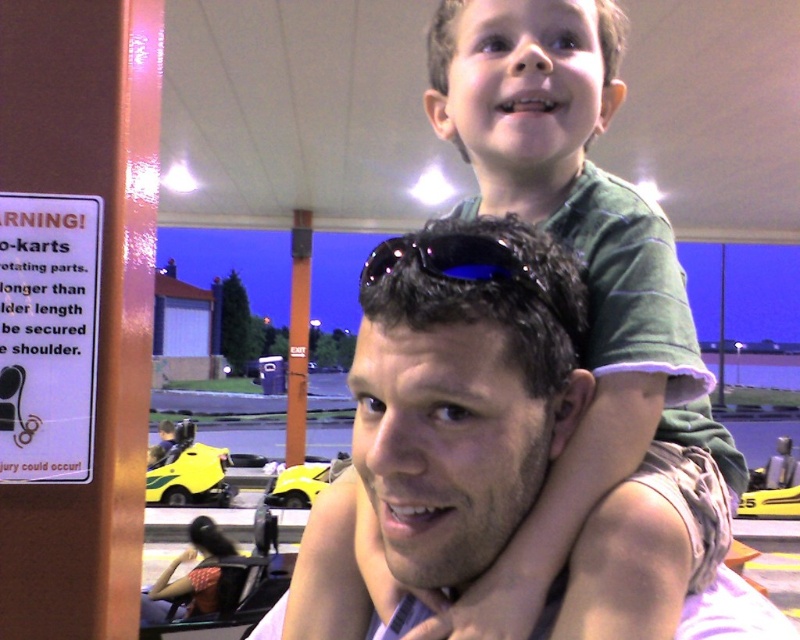
What is located at the coordinate point (188, 472) in the image?

At the coordinate point (188, 472) lies the yellow plastic go kart at lower left.